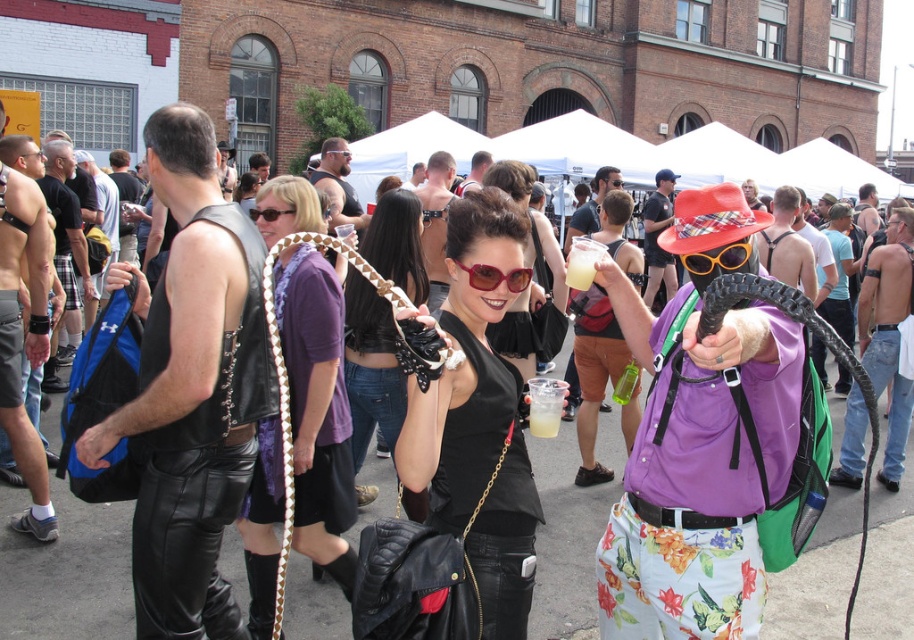
You are a fashion designer observing the crowd at the festival. You notice the purple satin scarf at center and the black plastic goggles at center. Which accessory do you think would be more suitable for a runway show that emphasizes bold, statement pieces?

The purple satin scarf at center would be more suitable for a runway show emphasizing bold, statement pieces because it has a larger size compared to the black plastic goggles at center, making it a more eye catching accessory.

You are at the festival and see the purple satin scarf at center. Where exactly is it positioned in relation to the large brick building in the background?

The purple satin scarf at center is located at point (316, 410), which places it in the foreground near the center of the image, closer to the viewer than the large brick building in the background.